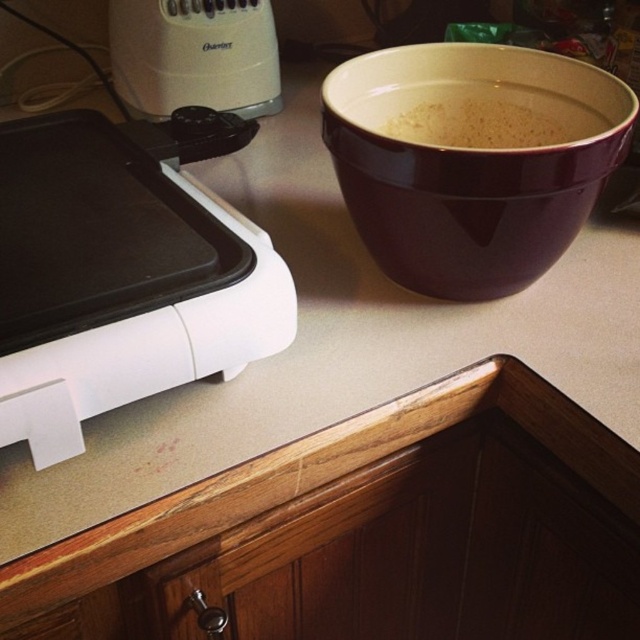
You are a chef preparing a recipe that requires a blender. You are currently at the point marked by coordinates point [195,54]. Is the blender located to the left or right of the white and black appliance?

The point [195,54] marks the white plastic blender at upper left, which is to the left of the white and black appliance. Therefore, the blender is located to the left of the white and black appliance.

You are standing in the kitchen and see the white glossy electric griddle at left. There is a point marked at coordinates (x=116, y=280). Where is this point located?

The point at (x=116, y=280) is located on the white glossy electric griddle at left.

You are a chef preparing ingredients on the kitchen countertop. You need to sprinkle the white matte powder at upper center onto the surface of the white glossy electric griddle at left. Can you reach the powder from your current position near the griddle?

The white glossy electric griddle at left is closer to the viewer than the white matte powder at upper center, so yes, you can reach the powder by extending your arm from the griddle to the powder since it is further away but still within arm